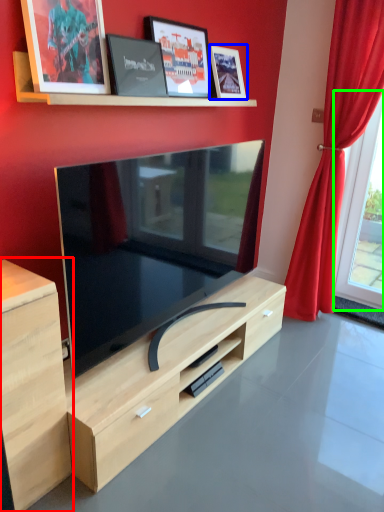
Question: Estimate the real-world distances between objects in this image. Which object is farther from cabinetry (highlighted by a red box), picture frame (highlighted by a blue box) or window (highlighted by a green box)?

Choices:
 (A) picture frame
 (B) window

Answer: (B)